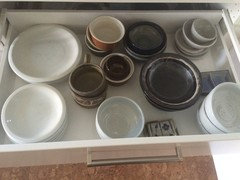
Identify the location of stack of grey bowls. This screenshot has height=180, width=240. (202, 37), (216, 102).